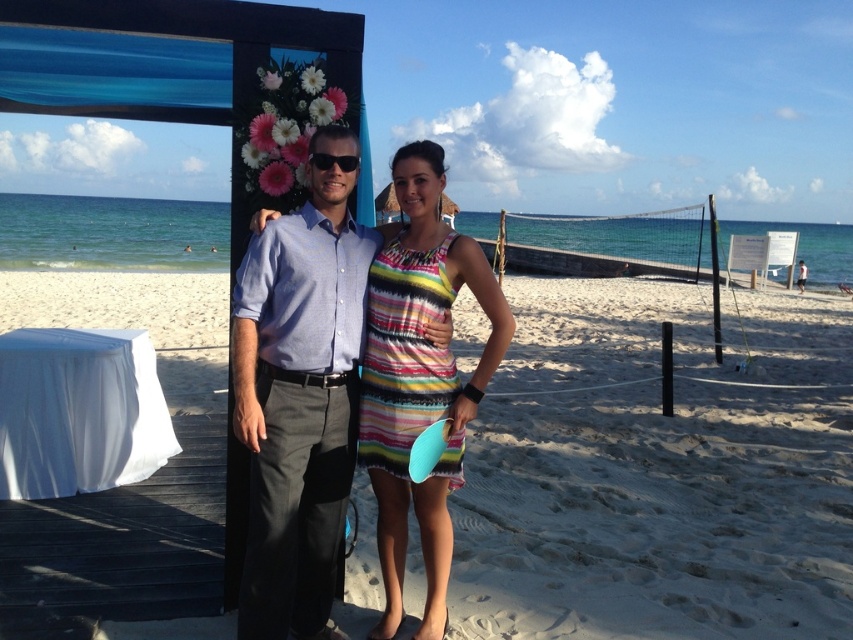
You are standing on the beach and want to place a small seashell on the white sand at center. However, you notice the striped fabric dress at center is in the way. Based on their positions, can you determine if the dress is blocking the sand from view?

The white sand at center is located above the striped fabric dress at center, meaning the dress is partially or fully blocking the sand from view.